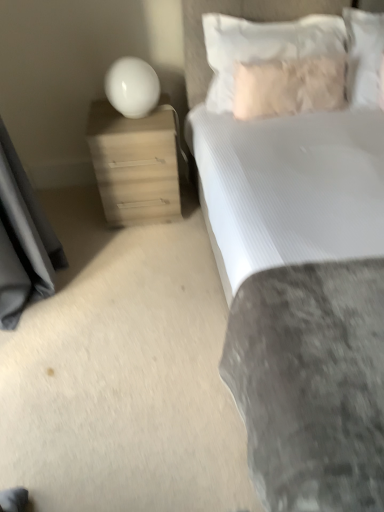
Where is `vacant area to the left of matte wood nightstand at left`? vacant area to the left of matte wood nightstand at left is located at coordinates (76, 209).